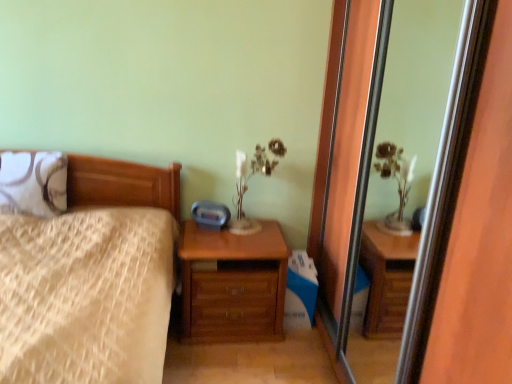
Question: Is matte white glass table lamp at upper center to the left of white textured pillow at left from the viewer's perspective?

Choices:
 (A) yes
 (B) no

Answer: (B)

Question: Is matte white glass table lamp at upper center touching white textured pillow at left?

Choices:
 (A) no
 (B) yes

Answer: (A)

Question: From the image's perspective, is matte white glass table lamp at upper center below white textured pillow at left?

Choices:
 (A) no
 (B) yes

Answer: (B)

Question: Is matte white glass table lamp at upper center far from white textured pillow at left?

Choices:
 (A) yes
 (B) no

Answer: (B)

Question: From the image's perspective, would you say matte white glass table lamp at upper center is positioned over white textured pillow at left?

Choices:
 (A) no
 (B) yes

Answer: (A)

Question: In terms of size, does transparent glass screen door at center appear bigger or smaller than white textured pillow at left?

Choices:
 (A) small
 (B) big

Answer: (B)

Question: Considering their positions, is transparent glass screen door at center located in front of or behind white textured pillow at left?

Choices:
 (A) front
 (B) behind

Answer: (A)

Question: Is transparent glass screen door at center wider or thinner than white textured pillow at left?

Choices:
 (A) wide
 (B) thin

Answer: (B)

Question: Which is correct: transparent glass screen door at center is inside white textured pillow at left, or outside of it?

Choices:
 (A) outside
 (B) inside

Answer: (A)

Question: Visually, is matte white glass table lamp at upper center positioned to the left or to the right of wooden bed at left?

Choices:
 (A) right
 (B) left

Answer: (A)

Question: Considering the positions of matte white glass table lamp at upper center and wooden bed at left in the image, is matte white glass table lamp at upper center bigger or smaller than wooden bed at left?

Choices:
 (A) big
 (B) small

Answer: (B)

Question: Considering the positions of point [265, 165] and point [113, 331], is point [265, 165] closer or farther from the camera than point [113, 331]?

Choices:
 (A) closer
 (B) farther

Answer: (B)

Question: In terms of width, does matte white glass table lamp at upper center look wider or thinner when compared to wooden bed at left?

Choices:
 (A) thin
 (B) wide

Answer: (A)

Question: From a real-world perspective, is transparent glass screen door at center above or below matte white glass table lamp at upper center?

Choices:
 (A) above
 (B) below

Answer: (A)

Question: Considering the positions of transparent glass screen door at center and matte white glass table lamp at upper center in the image, is transparent glass screen door at center taller or shorter than matte white glass table lamp at upper center?

Choices:
 (A) tall
 (B) short

Answer: (A)